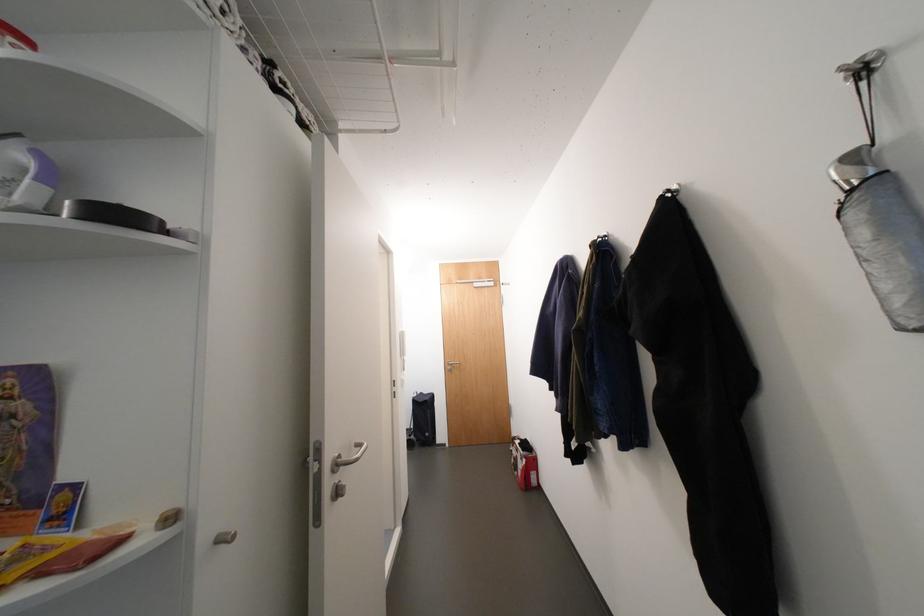
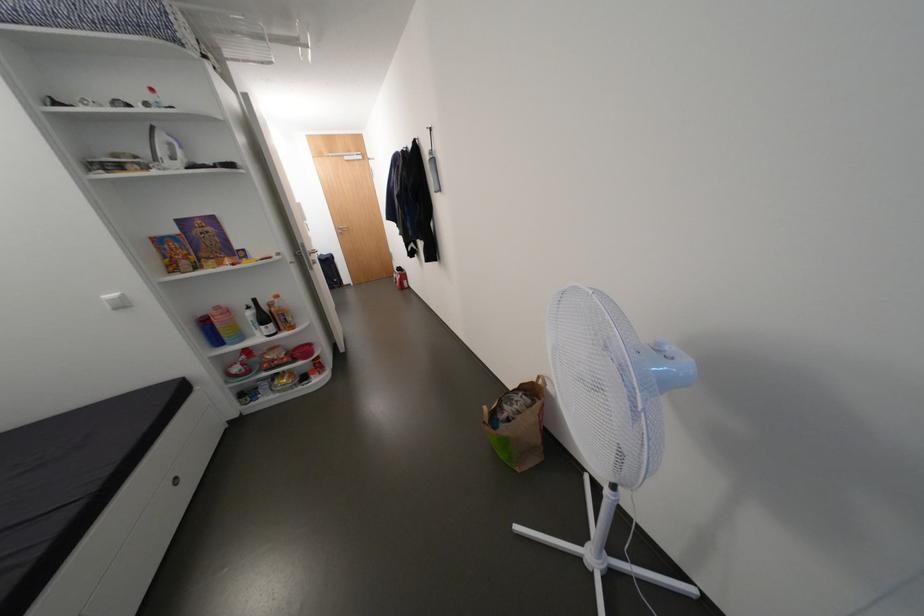
Locate, in the second image, the point that corresponds to point 527,445 in the first image.

(405, 270)